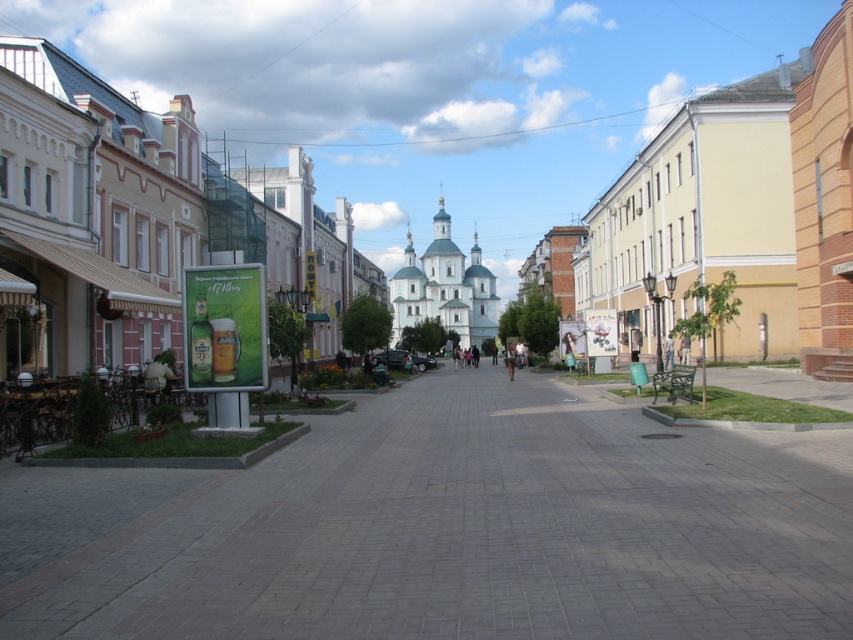
You are standing at the intersection of the street and need to decide whether to walk to the white stone church at center or the brown leather jacket at center first. Which one is closer to you?

The white stone church at center is 302.94 meters away from the brown leather jacket at center. Since both are at center, they are equidistant from your current position at the intersection, so you can choose either one first.

You are a tourist standing in the middle of the street. You see the white stone church at center and the denim pants at center. Which object is taller?

The white stone church at center is taller than the denim pants at center.